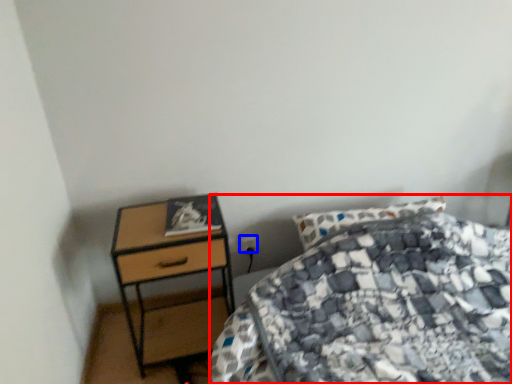
Question: Which object is further to the camera taking this photo, bed (highlighted by a red box) or power plugs and sockets (highlighted by a blue box)?

Choices:
 (A) bed
 (B) power plugs and sockets

Answer: (B)